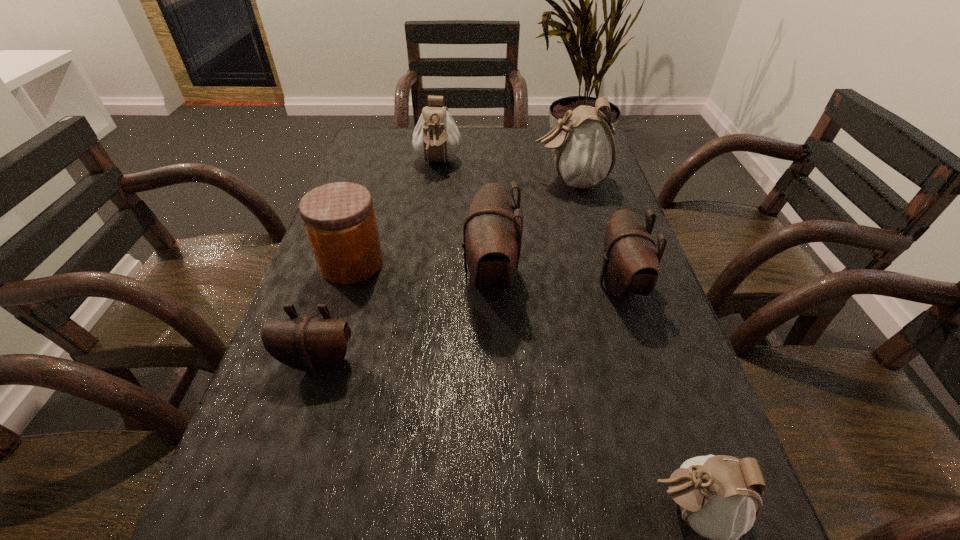
This screenshot has height=540, width=960. In order to click on vacant region located with the flap open on the nearest brown pouch in this screenshot , I will do `click(293, 441)`.

This screenshot has height=540, width=960. Identify the location of jar situated at the left edge. (339, 218).

Locate an element on the screen. pouch at the left edge is located at coordinates [311, 344].

Where is `object that is at the far right corner`? object that is at the far right corner is located at coordinates (583, 148).

Image resolution: width=960 pixels, height=540 pixels. I want to click on free location at the far edge of the desktop, so click(486, 133).

The height and width of the screenshot is (540, 960). I want to click on blank space at the left edge of the desktop, so click(x=400, y=181).

Locate an element on the screen. blank space at the right edge of the desktop is located at coordinates (663, 399).

In order to click on vacant region at the far left corner of the desktop in this screenshot , I will do `click(358, 160)`.

Identify the location of free spot between the orange jar and the biggest white pouch. (461, 222).

Image resolution: width=960 pixels, height=540 pixels. Find the location of `free space between the second smallest white pouch and the jar`. free space between the second smallest white pouch and the jar is located at coordinates (395, 214).